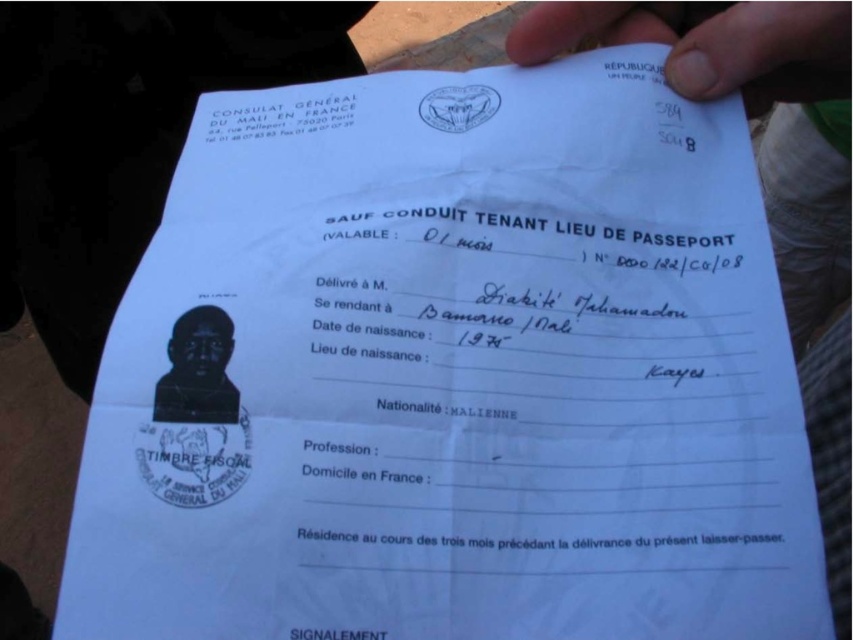
Between point (756, 35) and point (178, 349), which one is positioned in front?

Positioned in front is point (178, 349).

Does white paper at upper center have a larger size compared to black matte passport photo at center?

Yes, white paper at upper center is bigger than black matte passport photo at center.

Where is `white paper at upper center`? white paper at upper center is located at coordinates (708, 44).